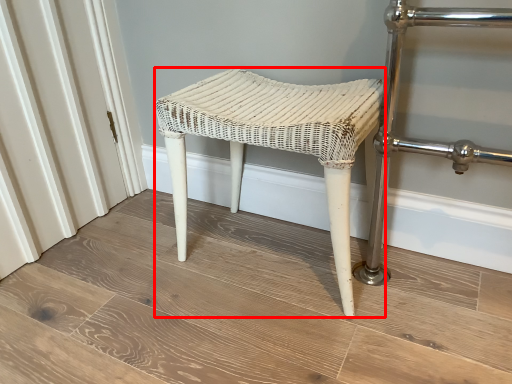
Question: From the image's perspective, where is stool (annotated by the red box) located relative to plank?

Choices:
 (A) below
 (B) above

Answer: (B)